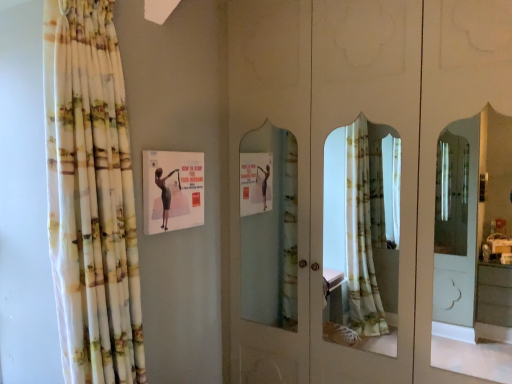
What is the approximate height of floral fabric curtain at left?

The height of floral fabric curtain at left is 5.61 feet.

You are a GUI agent. You are given a task and a screenshot of the screen. Output one action in this format:
    pyautogui.click(x=<x>, y=<y>)
    Task: Click on the floral fabric curtain at left
    The image size is (512, 384).
    Given the screenshot: What is the action you would take?
    pyautogui.click(x=91, y=196)

Describe the element at coordinates (91, 196) in the screenshot. I see `floral fabric curtain at left` at that location.

What are the coordinates of `matte paper poster at upper center` in the screenshot? It's located at (172, 190).

Describe the element at coordinates (172, 190) in the screenshot. I see `matte paper poster at upper center` at that location.

This screenshot has width=512, height=384. What are the coordinates of `floral fabric curtain at left` in the screenshot? It's located at (91, 196).

Between floral fabric curtain at left and matte paper poster at upper center, which one appears on the right side from the viewer's perspective?

From the viewer's perspective, matte paper poster at upper center appears more on the right side.

Which is behind, floral fabric curtain at left or matte paper poster at upper center?

matte paper poster at upper center is behind.

Does point (72, 186) appear closer or farther from the camera than point (172, 214)?

Point (72, 186).

From the image's perspective, relative to matte paper poster at upper center, is floral fabric curtain at left above or below?

floral fabric curtain at left is situated lower than matte paper poster at upper center in the image.

From a real-world perspective, is floral fabric curtain at left on top of matte paper poster at upper center?

No, from a real-world perspective, floral fabric curtain at left is not over matte paper poster at upper center

In the scene shown: Can you confirm if floral fabric curtain at left is wider than matte paper poster at upper center?

Yes.

Who is taller, floral fabric curtain at left or matte paper poster at upper center?

floral fabric curtain at left is taller.

Which of these two, floral fabric curtain at left or matte paper poster at upper center, is bigger?

Bigger between the two is floral fabric curtain at left.

Is floral fabric curtain at left located outside matte paper poster at upper center?

Absolutely, floral fabric curtain at left is external to matte paper poster at upper center.

Is floral fabric curtain at left positioned far away from matte paper poster at upper center?

That's not correct — floral fabric curtain at left is a little close to matte paper poster at upper center.

Is floral fabric curtain at left oriented towards matte paper poster at upper center?

No, floral fabric curtain at left is not facing towards matte paper poster at upper center.

How different are the orientations of floral fabric curtain at left and matte paper poster at upper center in degrees?

The angular difference between floral fabric curtain at left and matte paper poster at upper center is 3.53 degrees.

At what (x,y) coordinates should I click in order to perform the action: click on postcard behind the floral fabric curtain at left. Please return your answer as a coordinate pair (x, y). Looking at the image, I should click on (172, 190).

Is matte paper poster at upper center at the right side of floral fabric curtain at left?

Indeed, matte paper poster at upper center is positioned on the right side of floral fabric curtain at left.

Between matte paper poster at upper center and floral fabric curtain at left, which one is positioned in front?

floral fabric curtain at left is more forward.

Does point (154, 170) come behind point (106, 212)?

Yes.

From the image's perspective, is matte paper poster at upper center positioned above or below floral fabric curtain at left?

matte paper poster at upper center is situated higher than floral fabric curtain at left in the image.

From a real-world perspective, is matte paper poster at upper center physically below floral fabric curtain at left?

No, from a real-world perspective, matte paper poster at upper center is not below floral fabric curtain at left.

Is matte paper poster at upper center thinner than floral fabric curtain at left?

Yes.

Does matte paper poster at upper center have a lesser height compared to floral fabric curtain at left?

Correct, matte paper poster at upper center is not as tall as floral fabric curtain at left.

Considering the sizes of objects matte paper poster at upper center and floral fabric curtain at left in the image provided, who is smaller, matte paper poster at upper center or floral fabric curtain at left?

matte paper poster at upper center is smaller.

Does matte paper poster at upper center contain floral fabric curtain at left?

That's incorrect, floral fabric curtain at left is not inside matte paper poster at upper center.

Is matte paper poster at upper center with floral fabric curtain at left?

No, matte paper poster at upper center is not in contact with floral fabric curtain at left.

Could you tell me if matte paper poster at upper center is turned towards floral fabric curtain at left?

No, matte paper poster at upper center is not turned towards floral fabric curtain at left.

Where is `postcard on the right of floral fabric curtain at left`? The height and width of the screenshot is (384, 512). postcard on the right of floral fabric curtain at left is located at coordinates (172, 190).

Image resolution: width=512 pixels, height=384 pixels. Find the location of `postcard located behind the floral fabric curtain at left`. postcard located behind the floral fabric curtain at left is located at coordinates (172, 190).

The height and width of the screenshot is (384, 512). I want to click on curtain lying in front of the matte paper poster at upper center, so click(91, 196).